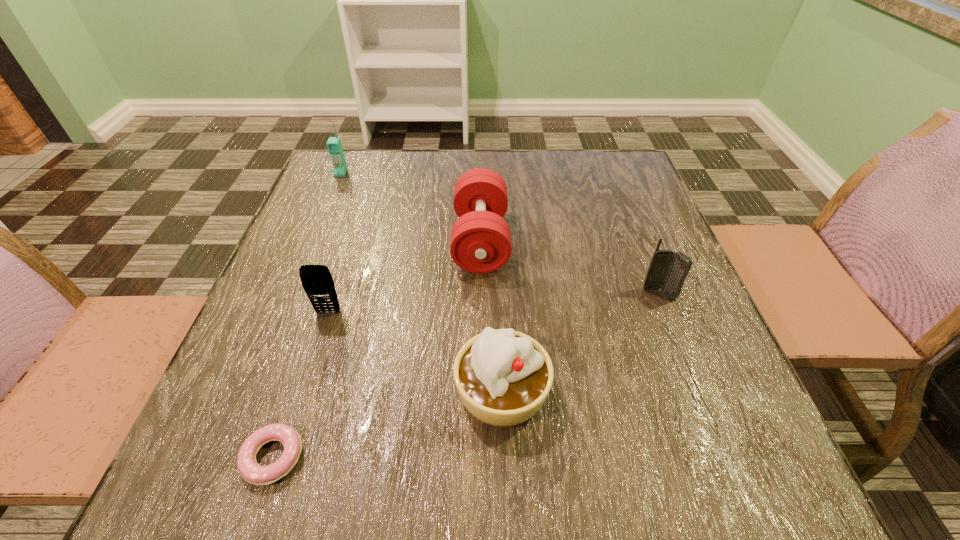
Find the location of a particular element. This screenshot has height=540, width=960. vacant space located 0.150m on the keyboard of the rightmost object is located at coordinates (687, 366).

The image size is (960, 540). Identify the location of free space located 0.150m on the right of the fifth nearest object. (574, 241).

Identify the location of free point located 0.230m on the screen of the second cellular telephone from right to left. (290, 432).

In order to click on free spot located 0.050m on the left of the whipped cream in this screenshot , I will do `click(424, 390)`.

Image resolution: width=960 pixels, height=540 pixels. What are the coordinates of `vacant space situated 0.250m on the right of the doughnut` in the screenshot? It's located at (472, 457).

Identify the location of object located in the far edge section of the desktop. (334, 145).

Find the location of a particular element. Image resolution: width=960 pixels, height=540 pixels. object located at the near edge is located at coordinates (249, 469).

Locate an element on the screen. This screenshot has height=540, width=960. doughnut that is at the left edge is located at coordinates (249, 469).

In order to click on object present at the right edge in this screenshot , I will do `click(667, 270)`.

The image size is (960, 540). Find the location of `object located at the far left corner`. object located at the far left corner is located at coordinates (334, 145).